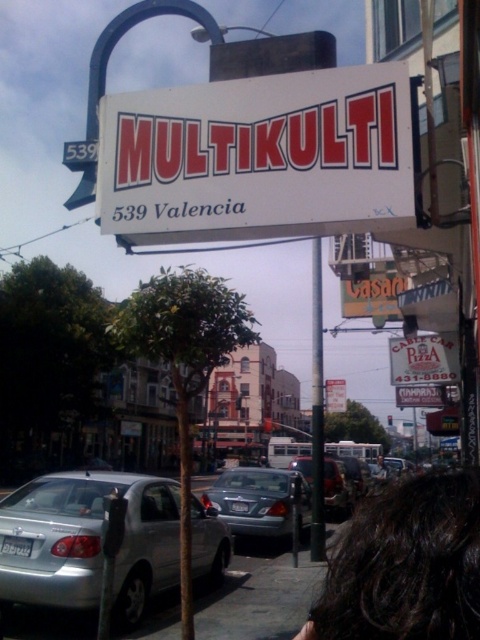
From the picture: Does white plastic sign at center appear under dark hair at lower right?

Incorrect, white plastic sign at center is not positioned below dark hair at lower right.

Is point (396, 86) closer to viewer compared to point (360, 573)?

No, (396, 86) is behind (360, 573).

Is point (215, 93) positioned in front of point (436, 611)?

No, (215, 93) is behind (436, 611).

Identify the location of white plastic sign at center. The width and height of the screenshot is (480, 640). (259, 156).

Consider the image. How much distance is there between dark hair at lower right and matte silver sedan at center?

dark hair at lower right and matte silver sedan at center are 50.75 feet apart from each other.

Can you confirm if dark hair at lower right is shorter than matte silver sedan at center?

Yes.

This screenshot has height=640, width=480. What are the coordinates of `dark hair at lower right` in the screenshot? It's located at click(x=406, y=564).

Find the location of `dark hair at lower right`. dark hair at lower right is located at coordinates (406, 564).

Is white paper sign at center shorter than brown leather jacket at lower right?

Correct, white paper sign at center is not as tall as brown leather jacket at lower right.

In the scene shown: Is white paper sign at center positioned before brown leather jacket at lower right?

Yes, white paper sign at center is in front of brown leather jacket at lower right.

Does point (432, 348) come closer to viewer compared to point (382, 458)?

Yes, it is.

Locate an element on the screen. white paper sign at center is located at coordinates (423, 358).